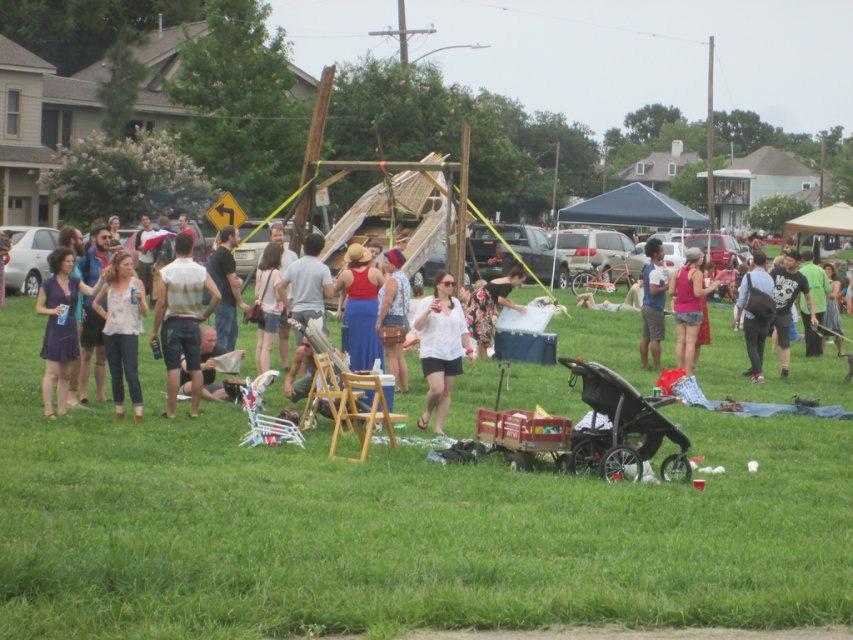
You are organizing a clothing donation drive and need to categorize items by size. You see a white matte shirt at center and a matte white blouse at center. Which item should you place in the large size bin?

The white matte shirt at center should be placed in the large size bin because it is bigger than the matte white blouse at center.